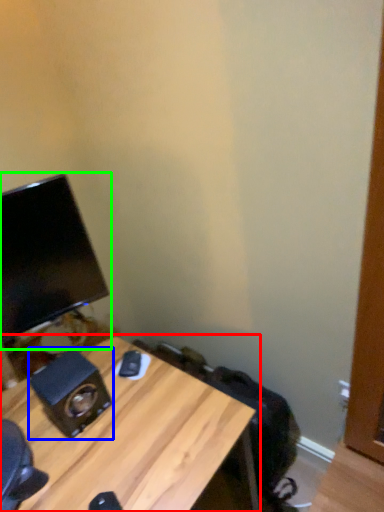
Question: Which is nearer to the desk (highlighted by a red box)? speaker (highlighted by a blue box) or computer monitor (highlighted by a green box).

Choices:
 (A) speaker
 (B) computer monitor

Answer: (A)